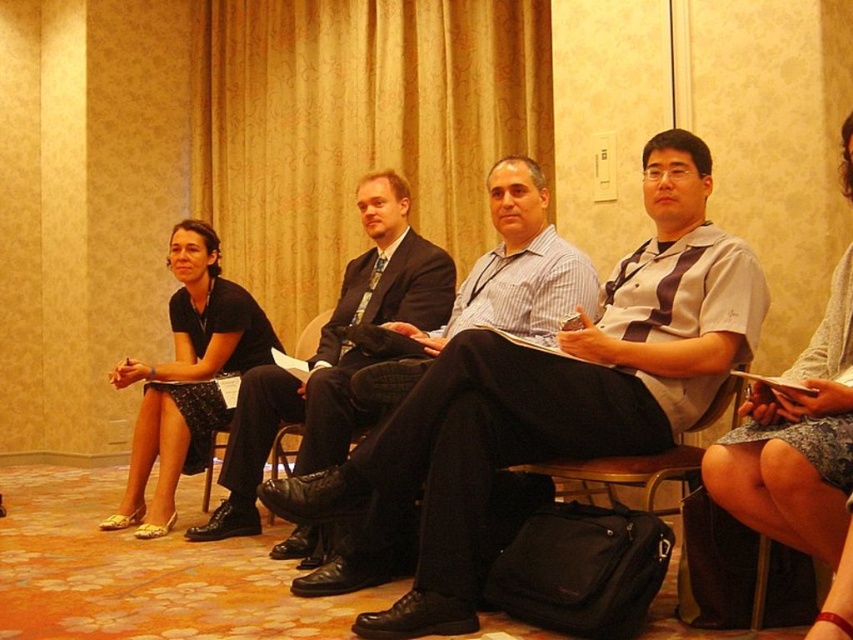
Question: Which object is positioned farthest from the matte black suit at center?

Choices:
 (A) denim skirt at lower right
 (B) black leather chair at center
 (C) brown leather chair at center

Answer: (A)

Question: Which of the following is the closest to the observer?

Choices:
 (A) (840, 288)
 (B) (280, 451)
 (C) (151, 461)

Answer: (A)

Question: Is matte black suit at center above brown leather chair at center?

Choices:
 (A) no
 (B) yes

Answer: (B)

Question: Which point is farther to the camera?

Choices:
 (A) (509, 272)
 (B) (567, 467)

Answer: (A)

Question: Can you confirm if denim skirt at lower right is positioned below brown leather chair at center?

Choices:
 (A) no
 (B) yes

Answer: (A)

Question: Does black fabric skirt at left lie behind light blue striped shirt at center?

Choices:
 (A) no
 (B) yes

Answer: (B)